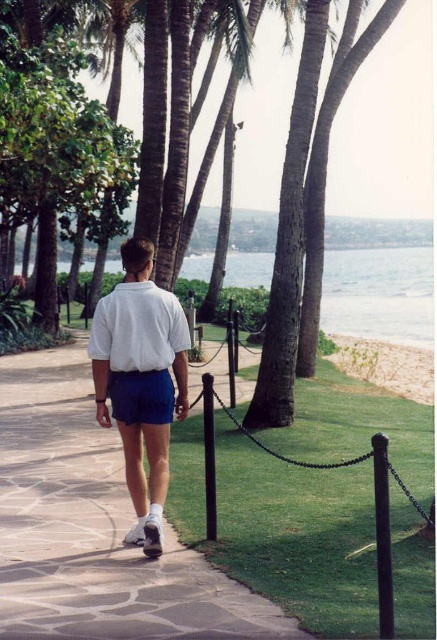
Is smooth stone pavement at center above clear blue water at center?

No.

Is smooth stone pavement at center to the left of clear blue water at center from the viewer's perspective?

Indeed, smooth stone pavement at center is positioned on the left side of clear blue water at center.

Identify the location of smooth stone pavement at center. (94, 528).

Is the position of smooth stone pavement at center less distant than that of white matte shirt at center?

Yes, smooth stone pavement at center is closer to the viewer.

Between smooth stone pavement at center and white matte shirt at center, which one is positioned lower?

smooth stone pavement at center

Is point (62, 584) positioned after point (149, 308)?

No, it is in front of (149, 308).

Where is `smooth stone pavement at center`? The width and height of the screenshot is (437, 640). smooth stone pavement at center is located at coordinates (94, 528).

Who is taller, white matte shirt at center or clear blue water at center?

clear blue water at center

Which is in front, point (117, 397) or point (332, 312)?

Point (117, 397) is more forward.

Locate an element on the screen. white matte shirt at center is located at coordinates (141, 380).